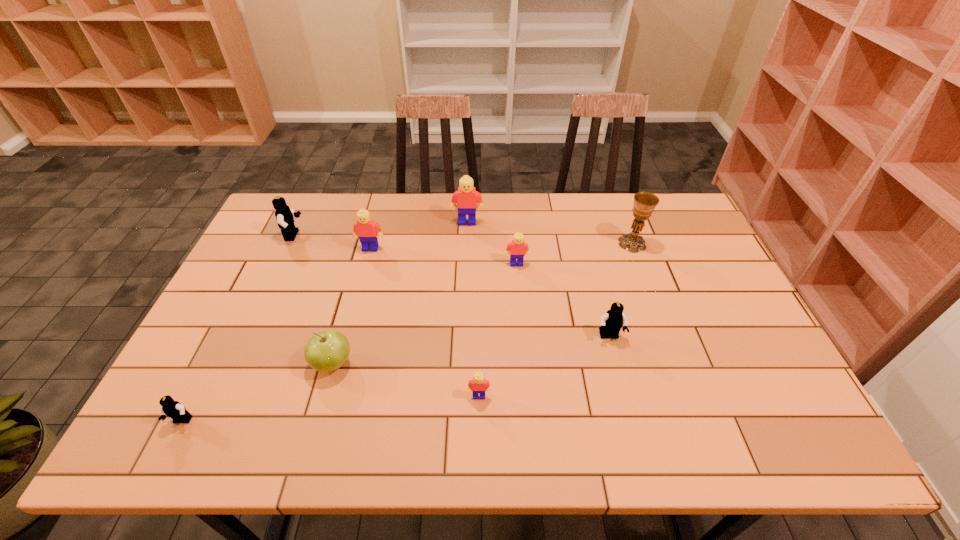
Select which black Lego appears as the closest to the chalice. Please provide its 2D coordinates. Your answer should be formatted as a tuple, i.e. [(x, y)], where the tuple contains the x and y coordinates of a point satisfying the conditions above.

[(611, 323)]